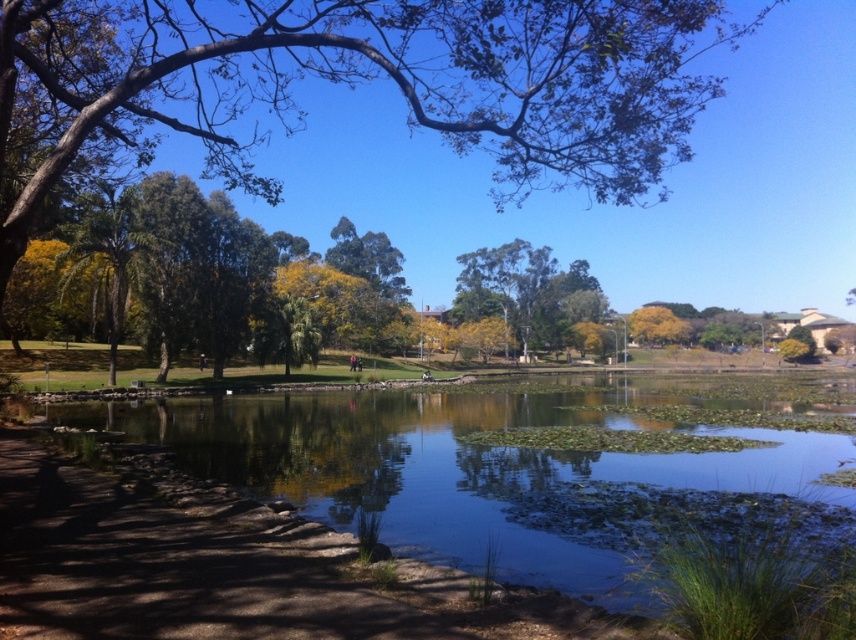
The width and height of the screenshot is (856, 640). Describe the element at coordinates (355, 83) in the screenshot. I see `green leafy tree at upper center` at that location.

How distant is green leafy tree at upper center from clear water at center?

green leafy tree at upper center and clear water at center are 47.72 meters apart from each other.

Which is behind, point (22, 122) or point (591, 417)?

Positioned behind is point (591, 417).

Image resolution: width=856 pixels, height=640 pixels. Find the location of `green leafy tree at upper center`. green leafy tree at upper center is located at coordinates (355, 83).